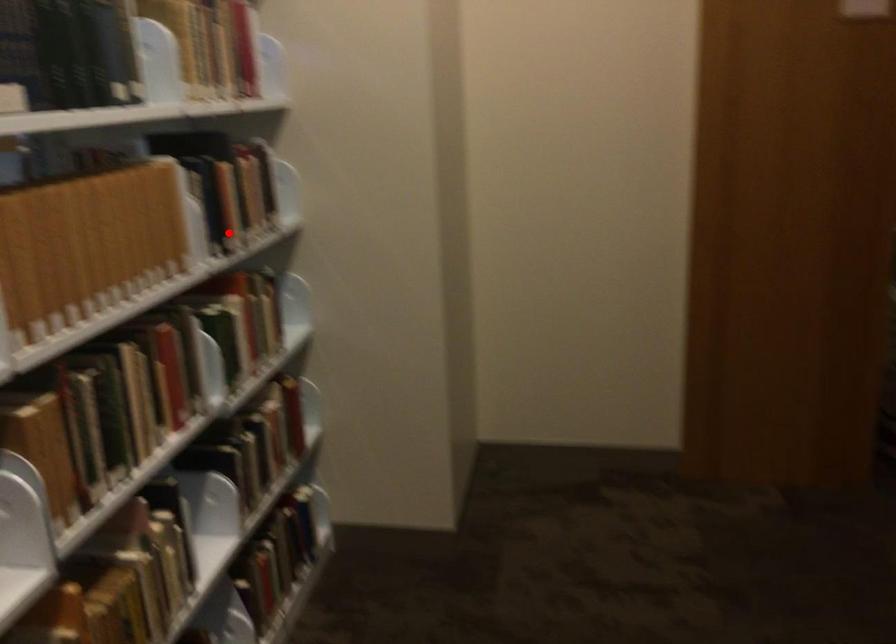
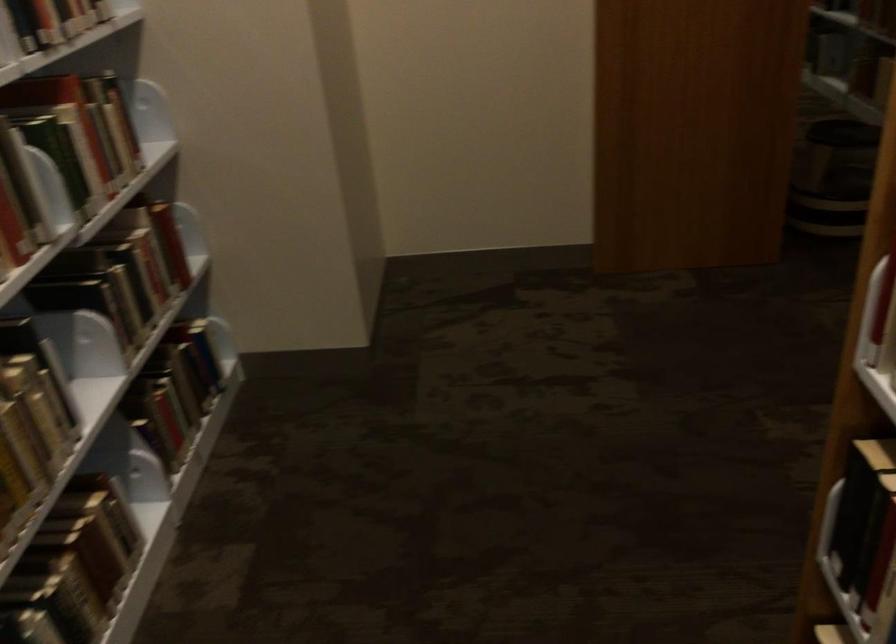
Question: I am providing you with two images of the same scene from different viewpoints. Given a red point in image1, look at the same physical point in image2. Is it:

Choices:
 (A) Closer to the viewpoint
 (B) Farther from the viewpoint

Answer: (A)